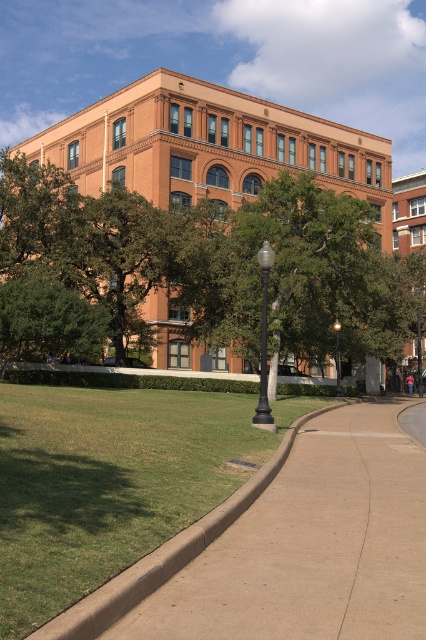
Question: Which object appears closest to the camera in this image?

Choices:
 (A) green leafy tree at upper left
 (B) green leafy tree at lower left
 (C) black polished metal lamp post at center

Answer: (C)

Question: Which point is closer to the camera taking this photo?

Choices:
 (A) (265, 420)
 (B) (270, 284)

Answer: (A)

Question: Can you confirm if brown concrete curb at lower left is thinner than black polished metal lamp post at center?

Choices:
 (A) no
 (B) yes

Answer: (A)

Question: Can you confirm if green leafy tree at lower left is thinner than black glass lamp post at center?

Choices:
 (A) yes
 (B) no

Answer: (B)

Question: Is green leafy tree at upper left bigger than black polished metal lamp post at center?

Choices:
 (A) no
 (B) yes

Answer: (B)

Question: Which object appears farthest from the camera in this image?

Choices:
 (A) black glass lamp post at center
 (B) green leafy tree at lower left
 (C) black polished metal lamp post at center

Answer: (A)